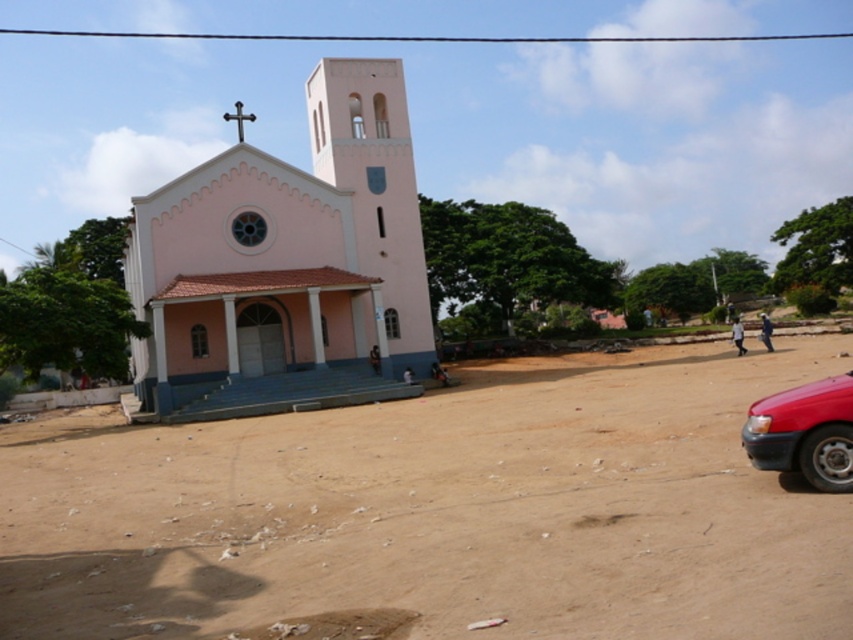
Question: Estimate the real-world distances between objects in this image. Which object is closer to the pink matte church at center?

Choices:
 (A) brown sandy dirt field at center
 (B) shiny red car at lower right

Answer: (A)

Question: Which point appears farthest from the camera in this image?

Choices:
 (A) (834, 420)
 (B) (328, 269)
 (C) (711, 426)

Answer: (B)

Question: Does brown sandy dirt field at center appear on the right side of pink matte church at center?

Choices:
 (A) yes
 (B) no

Answer: (A)

Question: Is brown sandy dirt field at center to the right of pink matte church at center from the viewer's perspective?

Choices:
 (A) no
 (B) yes

Answer: (B)

Question: Does brown sandy dirt field at center appear under pink matte church at center?

Choices:
 (A) no
 (B) yes

Answer: (B)

Question: Estimate the real-world distances between objects in this image. Which object is closer to the shiny red car at lower right?

Choices:
 (A) pink matte church at center
 (B) brown sandy dirt field at center

Answer: (B)